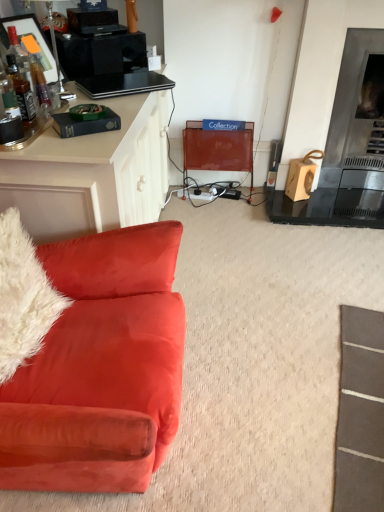
Question: Is white fluffy pillow at left touching metallic mesh swivel chair at center?

Choices:
 (A) yes
 (B) no

Answer: (B)

Question: Does white fluffy pillow at left have a larger size compared to metallic mesh swivel chair at center?

Choices:
 (A) no
 (B) yes

Answer: (B)

Question: Can you confirm if white fluffy pillow at left is shorter than metallic mesh swivel chair at center?

Choices:
 (A) no
 (B) yes

Answer: (B)

Question: Could you tell me if white fluffy pillow at left is turned towards metallic mesh swivel chair at center?

Choices:
 (A) yes
 (B) no

Answer: (B)

Question: From the image's perspective, is white fluffy pillow at left on top of metallic mesh swivel chair at center?

Choices:
 (A) no
 (B) yes

Answer: (A)

Question: Relative to white fluffy pillow at left, is metallic mesh swivel chair at center in front or behind?

Choices:
 (A) front
 (B) behind

Answer: (B)

Question: Looking at the image, does metallic mesh swivel chair at center seem bigger or smaller compared to white fluffy pillow at left?

Choices:
 (A) small
 (B) big

Answer: (A)

Question: Considering the positions of metallic mesh swivel chair at center and white fluffy pillow at left in the image, is metallic mesh swivel chair at center wider or thinner than white fluffy pillow at left?

Choices:
 (A) thin
 (B) wide

Answer: (A)

Question: From the image's perspective, relative to white fluffy pillow at left, is metallic mesh swivel chair at center above or below?

Choices:
 (A) below
 (B) above

Answer: (B)

Question: Considering the positions of point (31, 310) and point (205, 155), is point (31, 310) closer or farther from the camera than point (205, 155)?

Choices:
 (A) farther
 (B) closer

Answer: (B)

Question: Considering the relative positions of velvet orange couch at left and metallic mesh swivel chair at center in the image provided, is velvet orange couch at left to the left or to the right of metallic mesh swivel chair at center?

Choices:
 (A) left
 (B) right

Answer: (A)

Question: Looking at the image, does velvet orange couch at left seem bigger or smaller compared to metallic mesh swivel chair at center?

Choices:
 (A) small
 (B) big

Answer: (B)

Question: Is velvet orange couch at left wider or thinner than metallic mesh swivel chair at center?

Choices:
 (A) thin
 (B) wide

Answer: (B)

Question: Is metallic silver fireplace at right in front of or behind metallic mesh swivel chair at center in the image?

Choices:
 (A) behind
 (B) front

Answer: (B)

Question: Is metallic silver fireplace at right bigger or smaller than metallic mesh swivel chair at center?

Choices:
 (A) small
 (B) big

Answer: (B)